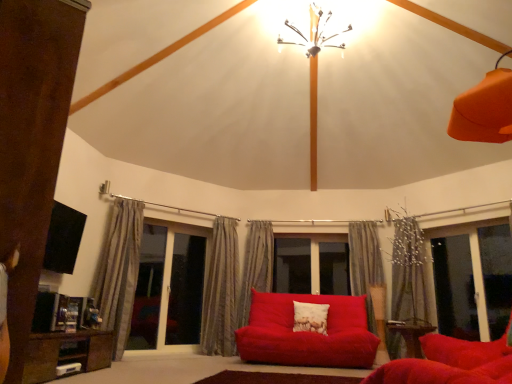
Question: Is silky gray curtain at center, placed as the 3th curtain when sorted from right to left, surrounded by metallic chandelier at upper center?

Choices:
 (A) yes
 (B) no

Answer: (B)

Question: From a real-world perspective, is metallic chandelier at upper center positioned under silky gray curtain at center, marked as the third curtain in a left-to-right arrangement, based on gravity?

Choices:
 (A) yes
 (B) no

Answer: (B)

Question: Does metallic chandelier at upper center appear on the left side of silky gray curtain at center, placed as the 3th curtain when sorted from right to left?

Choices:
 (A) yes
 (B) no

Answer: (B)

Question: Is metallic chandelier at upper center wider than silky gray curtain at center, placed as the 3th curtain when sorted from right to left?

Choices:
 (A) yes
 (B) no

Answer: (A)

Question: Considering the relative sizes of metallic chandelier at upper center and silky gray curtain at center, marked as the third curtain in a left-to-right arrangement, in the image provided, is metallic chandelier at upper center smaller than silky gray curtain at center, marked as the third curtain in a left-to-right arrangement,?

Choices:
 (A) no
 (B) yes

Answer: (A)

Question: From a real-world perspective, relative to white textured pillow at center, is wooden table at lower right, which ranks as the 1th table in right-to-left order, vertically above or below?

Choices:
 (A) above
 (B) below

Answer: (B)

Question: Is wooden table at lower right, which ranks as the 1th table in right-to-left order, situated inside white textured pillow at center or outside?

Choices:
 (A) outside
 (B) inside

Answer: (A)

Question: Looking at the image, does wooden table at lower right, which ranks as the 1th table in right-to-left order, seem bigger or smaller compared to white textured pillow at center?

Choices:
 (A) small
 (B) big

Answer: (B)

Question: From the image's perspective, relative to white textured pillow at center, is wooden table at lower right, which ranks as the 1th table in right-to-left order, above or below?

Choices:
 (A) above
 (B) below

Answer: (B)

Question: Does point (x=96, y=365) appear closer or farther from the camera than point (x=230, y=246)?

Choices:
 (A) farther
 (B) closer

Answer: (B)

Question: From a real-world perspective, is brown wooden table at lower left, marked as the 2th table in a right-to-left arrangement, physically located above or below silky beige curtain at center, which is the 2th curtain in left-to-right order?

Choices:
 (A) below
 (B) above

Answer: (A)

Question: Is brown wooden table at lower left, the 1th table from the left, taller or shorter than silky beige curtain at center, which appears as the 4th curtain when viewed from the right?

Choices:
 (A) tall
 (B) short

Answer: (B)

Question: In the image, is brown wooden table at lower left, acting as the 2th table starting from the back, on the left side or the right side of silky beige curtain at center, which appears as the 4th curtain when viewed from the right?

Choices:
 (A) left
 (B) right

Answer: (A)

Question: In terms of size, does white textured pillow at center appear bigger or smaller than transparent glass screen door at left, the first screen door viewed from the left?

Choices:
 (A) small
 (B) big

Answer: (A)

Question: Is point (326, 319) closer or farther from the camera than point (175, 301)?

Choices:
 (A) closer
 (B) farther

Answer: (A)